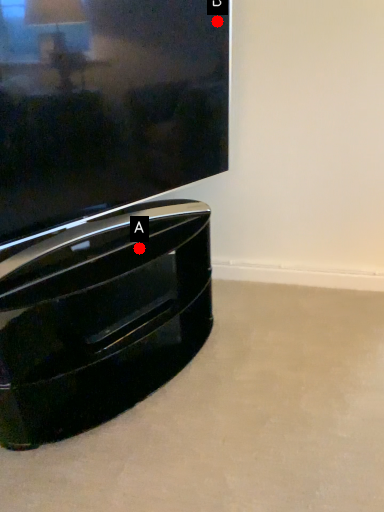
Question: Two points are circled on the image, labeled by A and B beside each circle. Which point is further to the camera?

Choices:
 (A) A is further
 (B) B is further

Answer: (B)